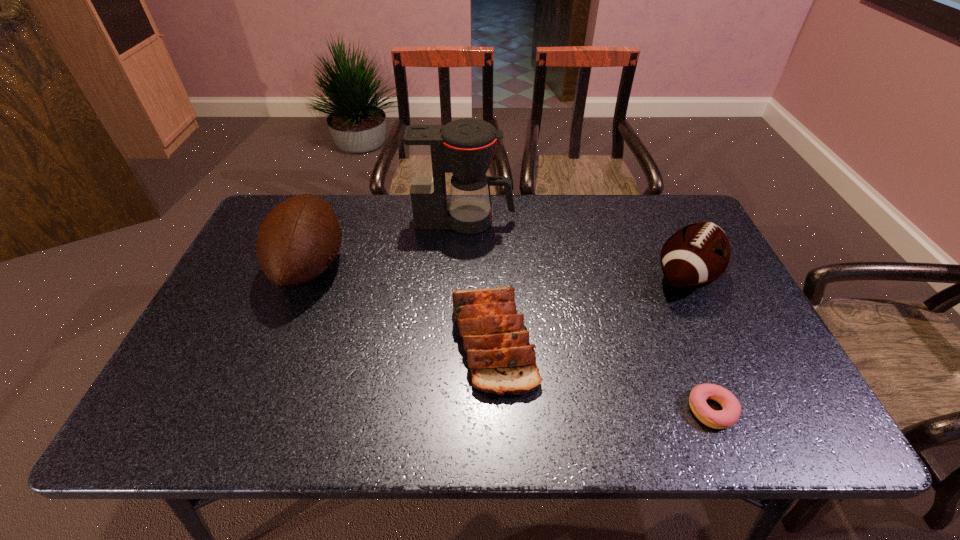
Where is `free space at the far edge`? free space at the far edge is located at coordinates (351, 198).

Find the location of a particular element. The height and width of the screenshot is (540, 960). vacant space at the near edge of the desktop is located at coordinates (716, 431).

The width and height of the screenshot is (960, 540). In the image, there is a desktop. What are the coordinates of `vacant space at the left edge` in the screenshot? It's located at (247, 259).

In order to click on vacant space at the right edge of the desktop in this screenshot , I will do `click(720, 326)`.

Where is `vacant space at the far right corner of the desktop`? This screenshot has width=960, height=540. vacant space at the far right corner of the desktop is located at coordinates (680, 201).

Locate an element on the screen. The image size is (960, 540). vacant area that lies between the shorter football (American) and the leftmost object is located at coordinates (498, 272).

Locate an element on the screen. The width and height of the screenshot is (960, 540). vacant space that is in between the second shortest object and the coffee maker is located at coordinates (479, 281).

Image resolution: width=960 pixels, height=540 pixels. I want to click on vacant space that is in between the shorter football (American) and the doughnut, so click(699, 343).

At what (x,y) coordinates should I click in order to perform the action: click on free space that is in between the third shortest object and the coffee maker. Please return your answer as a coordinate pair (x, y). Looking at the image, I should click on (575, 249).

This screenshot has height=540, width=960. I want to click on empty space between the bread and the tallest object, so click(479, 281).